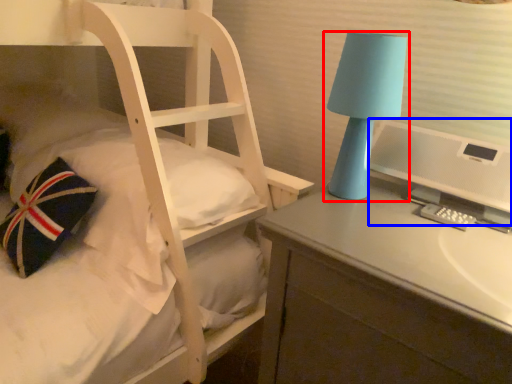
Question: Which object is further to the camera taking this photo, lamp (highlighted by a red box) or computer monitor (highlighted by a blue box)?

Choices:
 (A) lamp
 (B) computer monitor

Answer: (A)